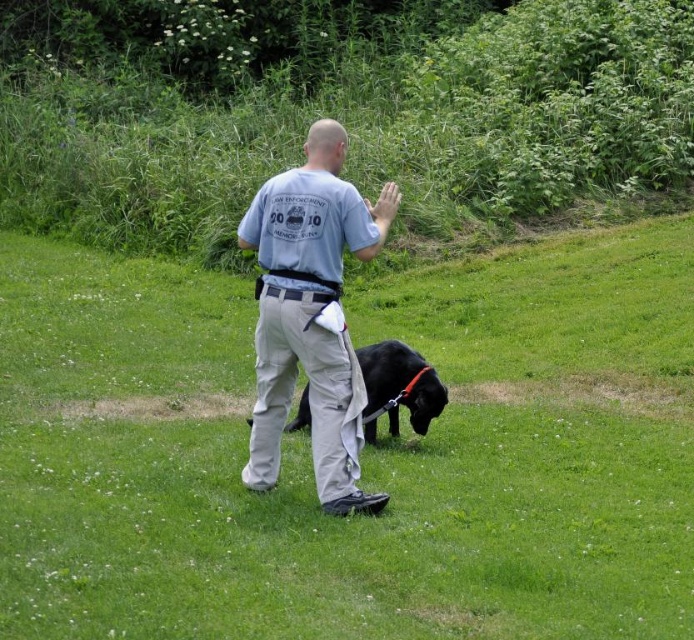
Does green grass at center appear on the left side of black leather belt at center?

No, green grass at center is not to the left of black leather belt at center.

Between green grass at center and black leather belt at center, which one is positioned lower?

green grass at center is below.

Which is in front, point (648, 608) or point (332, 294)?

Positioned in front is point (648, 608).

The image size is (694, 640). I want to click on green grass at center, so click(x=362, y=452).

Which is above, gray cotton shirt at center or black matte dog at center?

gray cotton shirt at center is higher up.

Does gray cotton shirt at center appear under black matte dog at center?

Actually, gray cotton shirt at center is above black matte dog at center.

Where is `gray cotton shirt at center`? The image size is (694, 640). gray cotton shirt at center is located at coordinates (312, 316).

Looking at this image, is black matte dog at center to the left of black leather belt at center from the viewer's perspective?

No, black matte dog at center is not to the left of black leather belt at center.

Who is more distant from viewer, (434, 412) or (325, 296)?

The point (434, 412) is behind.

Does point (396, 417) come closer to viewer compared to point (314, 291)?

No, (396, 417) is further to viewer.

Locate an element on the screen. black matte dog at center is located at coordinates (398, 387).